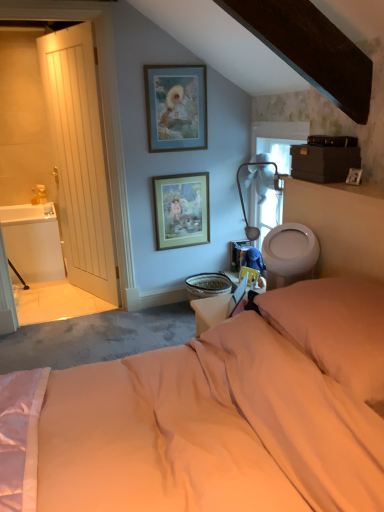
Question: Is blue matte picture frame at upper center, which ranks as the first picture frame in top-to-bottom order, inside or outside of white glossy toilet bowl at right?

Choices:
 (A) outside
 (B) inside

Answer: (A)

Question: Considering the positions of point (190, 95) and point (304, 268), is point (190, 95) closer or farther from the camera than point (304, 268)?

Choices:
 (A) farther
 (B) closer

Answer: (A)

Question: Considering the real-world distances, which object is farthest from the white glossy sink at left?

Choices:
 (A) soft pink pillow at lower right
 (B) white wooden door at left
 (C) wooden framed print at center, the 2th picture frame when ordered from top to bottom
 (D) white glossy toilet bowl at right
 (E) blue matte picture frame at upper center, which ranks as the first picture frame in top-to-bottom order

Answer: (A)

Question: Which object is the farthest from the soft pink pillow at lower right?

Choices:
 (A) white glossy sink at left
 (B) white fabric lampshade at upper center
 (C) white wooden door at left
 (D) blue matte picture frame at upper center, which ranks as the first picture frame in top-to-bottom order
 (E) white glossy toilet bowl at right

Answer: (A)